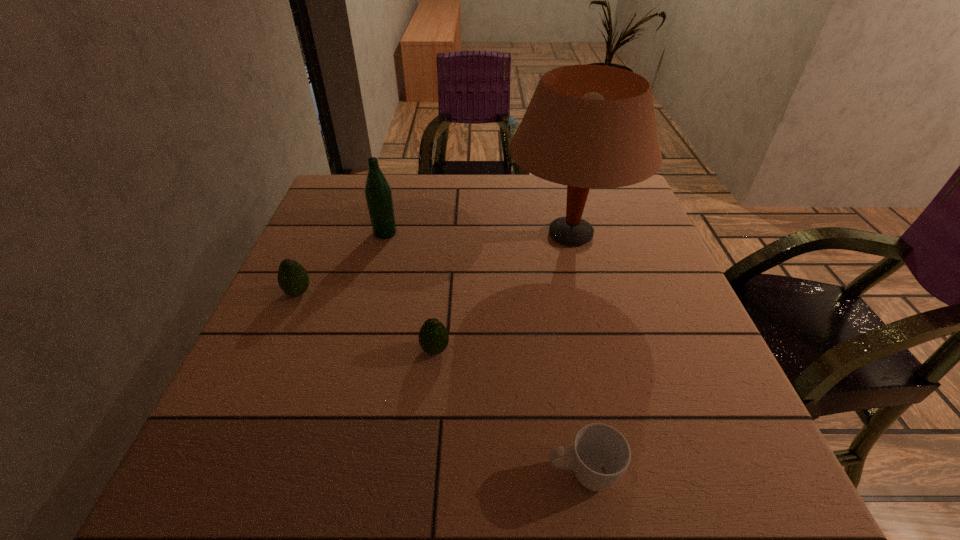
The width and height of the screenshot is (960, 540). I want to click on vacant region located on the front-facing side of the tallest object, so click(x=418, y=234).

Where is `vacant space located 0.110m on the back of the second tallest object`? vacant space located 0.110m on the back of the second tallest object is located at coordinates (394, 202).

At what (x,y) coordinates should I click in order to perform the action: click on free space located on the front of the third nearest object. Please return your answer as a coordinate pair (x, y). Looking at the image, I should click on (261, 377).

This screenshot has height=540, width=960. In order to click on vacant position located 0.120m on the right of the second nearest object in this screenshot , I will do `click(513, 350)`.

Image resolution: width=960 pixels, height=540 pixels. What are the coordinates of `vacant space situated 0.060m with the handle on the side of the nearest object` in the screenshot? It's located at (506, 475).

The image size is (960, 540). Identify the location of free space located 0.330m with the handle on the side of the nearest object. (x=327, y=475).

This screenshot has height=540, width=960. I want to click on vacant region located with the handle on the side of the nearest object, so click(x=506, y=475).

The height and width of the screenshot is (540, 960). I want to click on object that is at the far edge, so click(587, 126).

You are a GUI agent. You are given a task and a screenshot of the screen. Output one action in this format:
    pyautogui.click(x=<x>, y=<y>)
    Task: Click on the object present at the near edge
    The height and width of the screenshot is (540, 960).
    Given the screenshot: What is the action you would take?
    pyautogui.click(x=600, y=454)

Find the location of a particular element. The image size is (960, 540). object at the left edge is located at coordinates (293, 279).